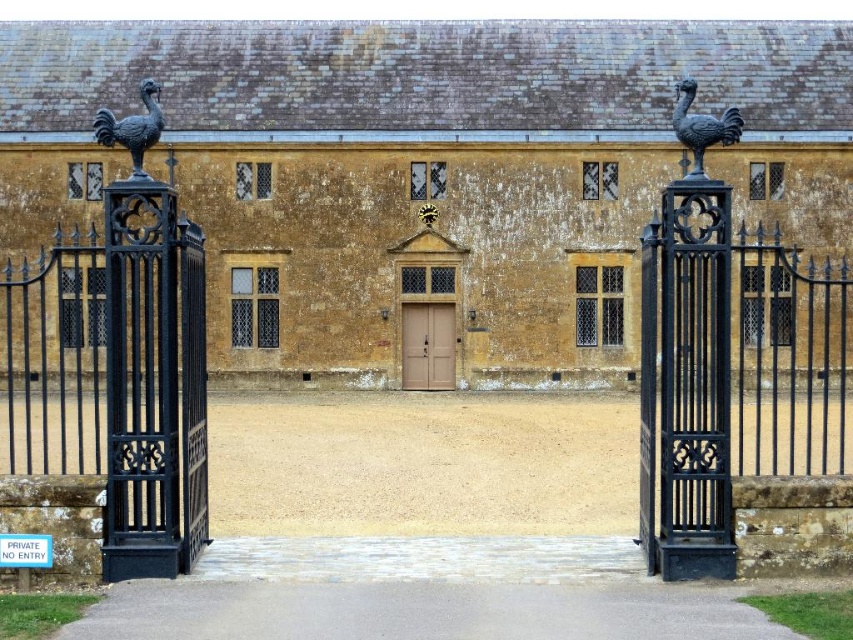
You are a delivery person approaching the entrance of the historic building. You need to deliver a package to the main entrance. Which object should you approach first, the black wrought iron gate at right or the brown wooden door at center?

The brown wooden door at center is at the center, so you should approach the brown wooden door at center first to deliver the package.

You are standing at the entrance of the historic building and want to walk towards the point labeled as point (376,60). Which direction should you move relative to the point labeled as point (50,285)?

Point (376,60) is behind point (50,285), so you should move in the direction away from point (50,285) to reach point (376,60).

You are an architect assessing the proportions of the matte gold stone building at center and the black wrought iron gate at right. Which structure would require more materials to construct based on their sizes?

The matte gold stone building at center is larger in size than the black wrought iron gate at right, so it would require more materials to construct.